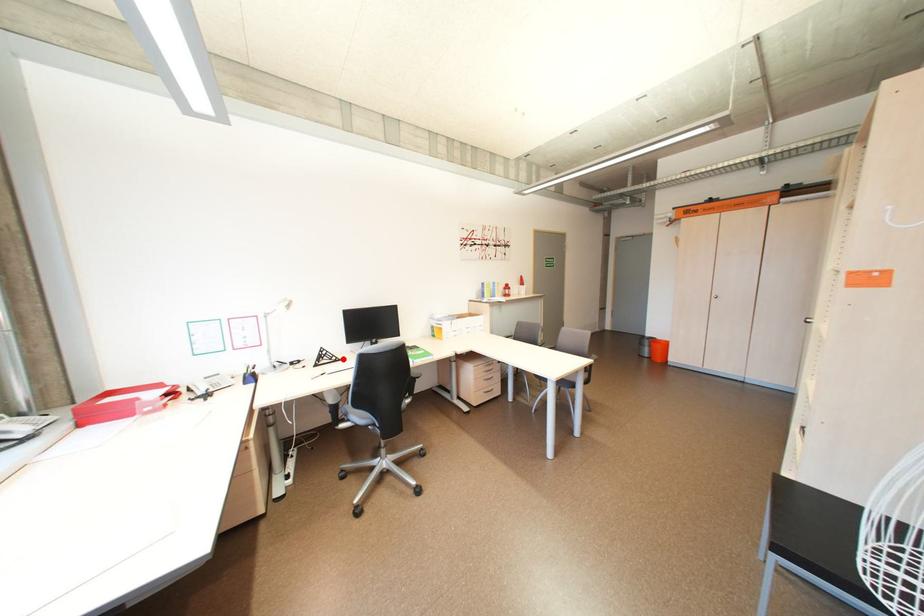
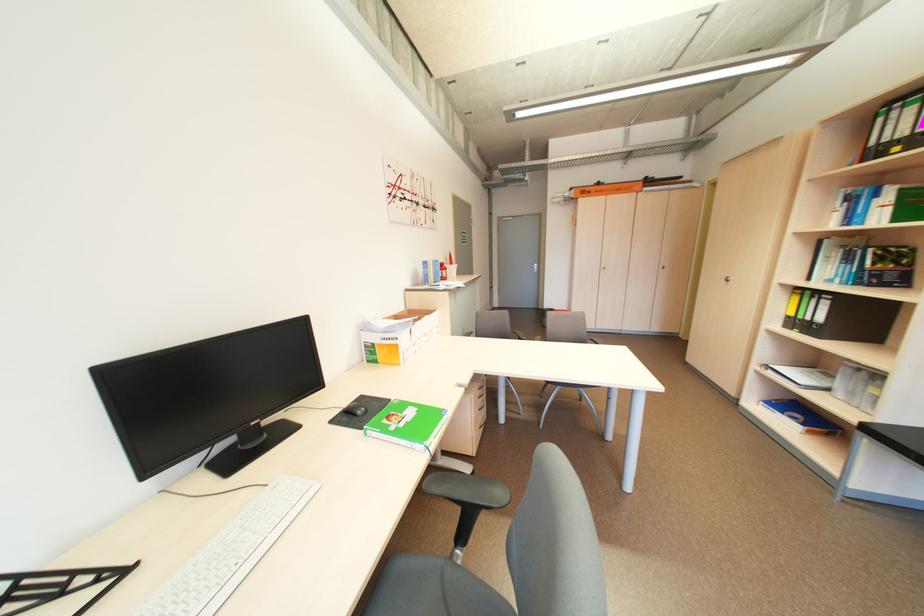
Find the pixel in the second image that matches the highlighted location in the first image.

(91, 582)